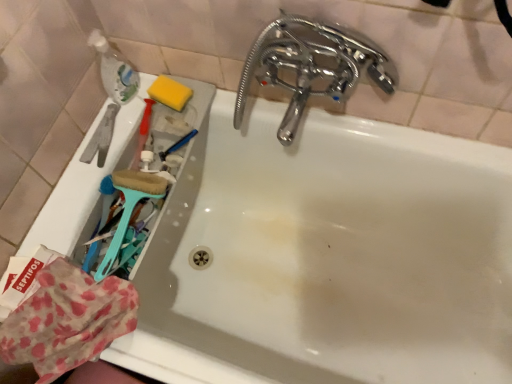
The image size is (512, 384). What do you see at coordinates (115, 70) in the screenshot? I see `translucent plastic bottle at upper left` at bounding box center [115, 70].

Describe the element at coordinates (170, 93) in the screenshot. This screenshot has width=512, height=384. I see `yellow sponge at upper left` at that location.

Describe the element at coordinates (308, 66) in the screenshot. I see `chrome/metallic faucet at upper right` at that location.

Identify the location of translucent plastic bottle at upper left. (115, 70).

Who is taller, polka dot fabric at lower left or teal plastic brush at left?

teal plastic brush at left is taller.

From the picture: Is polka dot fabric at lower left in contact with teal plastic brush at left?

polka dot fabric at lower left and teal plastic brush at left are clearly separated.

This screenshot has width=512, height=384. In order to click on brush above the polka dot fabric at lower left (from the image's perspective) in this screenshot , I will do `click(129, 208)`.

Is polka dot fabric at lower left to the left of chrome/metallic faucet at upper right from the viewer's perspective?

Indeed, polka dot fabric at lower left is positioned on the left side of chrome/metallic faucet at upper right.

From the image's perspective, between polka dot fabric at lower left and chrome/metallic faucet at upper right, which one is located above?

From the image's view, chrome/metallic faucet at upper right is above.

From a real-world perspective, which object stands above the other?

From a 3D spatial view, chrome/metallic faucet at upper right is above.

Measure the distance from polka dot fabric at lower left to chrome/metallic faucet at upper right.

polka dot fabric at lower left is 21.99 inches away from chrome/metallic faucet at upper right.

Is point (101, 50) in front of point (292, 60)?

No, it is behind (292, 60).

Which is behind, translucent plastic bottle at upper left or chrome/metallic faucet at upper right?

translucent plastic bottle at upper left is behind.

From a real-world perspective, is translucent plastic bottle at upper left located beneath chrome/metallic faucet at upper right?

Indeed, from a real-world perspective, translucent plastic bottle at upper left is positioned beneath chrome/metallic faucet at upper right.

The height and width of the screenshot is (384, 512). Find the location of `bottle lying behind the chrome/metallic faucet at upper right`. bottle lying behind the chrome/metallic faucet at upper right is located at coordinates (115, 70).

Identify the location of brush below the chrome/metallic faucet at upper right (from a real-world perspective). (129, 208).

Consider the image. From the image's perspective, is teal plastic brush at left on top of chrome/metallic faucet at upper right?

No, from the image's perspective, teal plastic brush at left is not over chrome/metallic faucet at upper right.

Could you tell me if teal plastic brush at left is facing chrome/metallic faucet at upper right?

No, teal plastic brush at left is not aimed at chrome/metallic faucet at upper right.

Can you confirm if teal plastic brush at left is shorter than chrome/metallic faucet at upper right?

Indeed, teal plastic brush at left has a lesser height compared to chrome/metallic faucet at upper right.

Considering the relative positions of translucent plastic bottle at upper left and yellow sponge at upper left in the image provided, is translucent plastic bottle at upper left in front of yellow sponge at upper left?

That is True.

From a real-world perspective, is translucent plastic bottle at upper left located higher than yellow sponge at upper left?

Indeed, from a real-world perspective, translucent plastic bottle at upper left stands above yellow sponge at upper left.

Could you tell me if translucent plastic bottle at upper left is facing yellow sponge at upper left?

Yes, translucent plastic bottle at upper left is turned towards yellow sponge at upper left.

The height and width of the screenshot is (384, 512). I want to click on tap that appears on the right of translucent plastic bottle at upper left, so click(308, 66).

Would you consider chrome/metallic faucet at upper right to be distant from translucent plastic bottle at upper left?

No, chrome/metallic faucet at upper right is not far from translucent plastic bottle at upper left.

Can you confirm if chrome/metallic faucet at upper right is thinner than translucent plastic bottle at upper left?

In fact, chrome/metallic faucet at upper right might be wider than translucent plastic bottle at upper left.

From a real-world perspective, is chrome/metallic faucet at upper right located beneath translucent plastic bottle at upper left?

Actually, chrome/metallic faucet at upper right is physically above translucent plastic bottle at upper left in the real world.

Does point (334, 38) come behind point (17, 336)?

Yes, point (334, 38) is farther from viewer.

Consider the image. From a real-world perspective, between chrome/metallic faucet at upper right and polka dot fabric at lower left, who is vertically higher?

In real-world perspective, chrome/metallic faucet at upper right is above.

Considering the relative sizes of chrome/metallic faucet at upper right and polka dot fabric at lower left in the image provided, is chrome/metallic faucet at upper right bigger than polka dot fabric at lower left?

Correct, chrome/metallic faucet at upper right is larger in size than polka dot fabric at lower left.

Is chrome/metallic faucet at upper right shorter than polka dot fabric at lower left?

No.

Find the location of a particular element. Image resolution: width=512 pixels, height=384 pixels. brush behind the polka dot fabric at lower left is located at coordinates [129, 208].

You are a GUI agent. You are given a task and a screenshot of the screen. Output one action in this format:
    pyautogui.click(x=<x>, y=<y>)
    Task: Click on the tap above the polka dot fabric at lower left (from the image's perspective)
    The image size is (512, 384).
    Given the screenshot: What is the action you would take?
    pyautogui.click(x=308, y=66)

Looking at this image, considering their positions, is teal plastic brush at left positioned closer to chrome/metallic faucet at upper right than polka dot fabric at lower left?

Based on the image, teal plastic brush at left appears to be nearer to chrome/metallic faucet at upper right.

Estimate the real-world distances between objects in this image. Which object is closer to polka dot fabric at lower left, teal plastic brush at left or translucent plastic bottle at upper left?

teal plastic brush at left is closer to polka dot fabric at lower left.

From the image, which object appears to be nearer to polka dot fabric at lower left, yellow sponge at upper left or translucent plastic bottle at upper left?

The object closer to polka dot fabric at lower left is translucent plastic bottle at upper left.

When comparing their distances from yellow sponge at upper left, does translucent plastic bottle at upper left or chrome/metallic faucet at upper right seem closer?

translucent plastic bottle at upper left is positioned closer to the anchor yellow sponge at upper left.

Based on their spatial positions, is yellow sponge at upper left or chrome/metallic faucet at upper right further from polka dot fabric at lower left?

Based on the image, chrome/metallic faucet at upper right appears to be further to polka dot fabric at lower left.

From the image, which object appears to be farther from translucent plastic bottle at upper left, polka dot fabric at lower left or teal plastic brush at left?

polka dot fabric at lower left is positioned further to the anchor translucent plastic bottle at upper left.

When comparing their distances from teal plastic brush at left, does translucent plastic bottle at upper left or chrome/metallic faucet at upper right seem closer?

The object closer to teal plastic brush at left is translucent plastic bottle at upper left.

From the picture: From the image, which object appears to be nearer to translucent plastic bottle at upper left, chrome/metallic faucet at upper right or yellow sponge at upper left?

yellow sponge at upper left lies closer to translucent plastic bottle at upper left than the other object.

The width and height of the screenshot is (512, 384). Find the location of `brush between translucent plastic bottle at upper left and polka dot fabric at lower left in the up-down direction`. brush between translucent plastic bottle at upper left and polka dot fabric at lower left in the up-down direction is located at coordinates click(x=129, y=208).

I want to click on soap between translucent plastic bottle at upper left and polka dot fabric at lower left from top to bottom, so click(x=170, y=93).

Image resolution: width=512 pixels, height=384 pixels. I want to click on soap between translucent plastic bottle at upper left and chrome/metallic faucet at upper right, so click(x=170, y=93).

Find the location of a particular element. brush between polka dot fabric at lower left and chrome/metallic faucet at upper right from left to right is located at coordinates (129, 208).